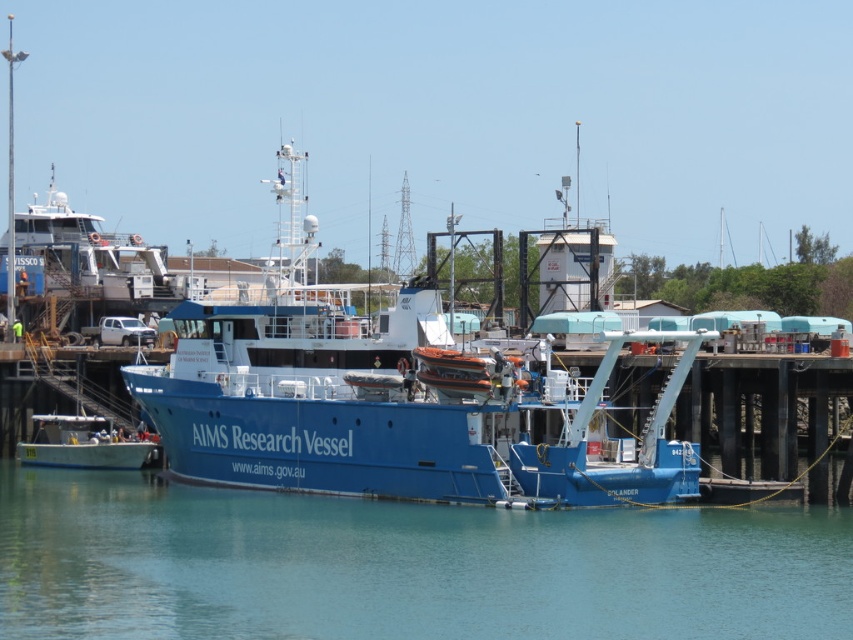
Question: Based on their relative distances, which object is nearer to the blue matte research vessel at center?

Choices:
 (A) blue matte boat at lower left
 (B) clear blue water at center

Answer: (B)

Question: Which object is farther from the camera taking this photo?

Choices:
 (A) clear blue water at center
 (B) blue matte research vessel at center

Answer: (B)

Question: In this image, where is blue matte research vessel at center located relative to blue matte boat at lower left?

Choices:
 (A) below
 (B) above

Answer: (B)

Question: Is clear blue water at center smaller than blue matte boat at lower left?

Choices:
 (A) no
 (B) yes

Answer: (A)

Question: Is clear blue water at center positioned at the back of blue matte boat at lower left?

Choices:
 (A) yes
 (B) no

Answer: (B)

Question: Which of the following is the closest to the observer?

Choices:
 (A) (148, 461)
 (B) (430, 320)
 (C) (105, 598)

Answer: (C)